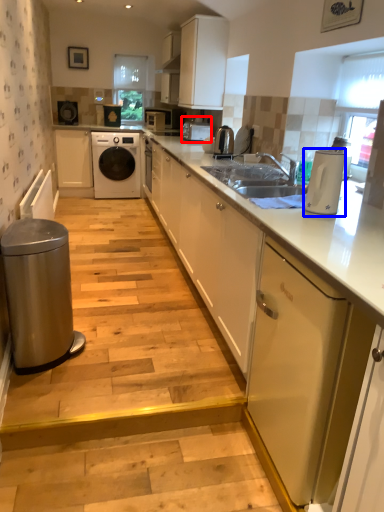
Question: Which object is further to the camera taking this photo, appliance (highlighted by a red box) or home appliance (highlighted by a blue box)?

Choices:
 (A) appliance
 (B) home appliance

Answer: (A)